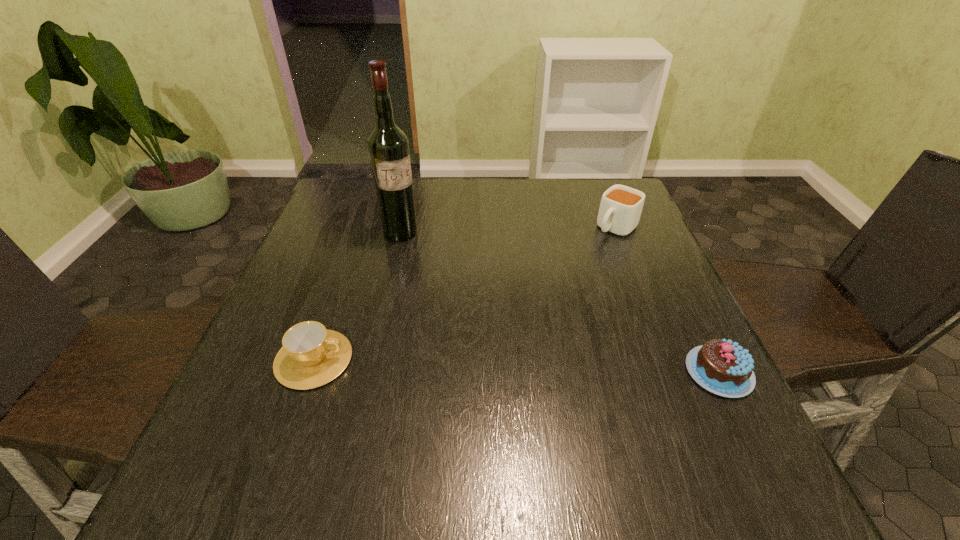
I want to click on free spot on the desktop that is between the shorter cup and the chocolate cake and is positioned on the front and back of the wine bottle, so click(515, 366).

Locate an element on the screen. The height and width of the screenshot is (540, 960). vacant space on the desktop that is between the left cup and the chocolate cake and is positioned on the side with the handle of the right cup is located at coordinates (472, 364).